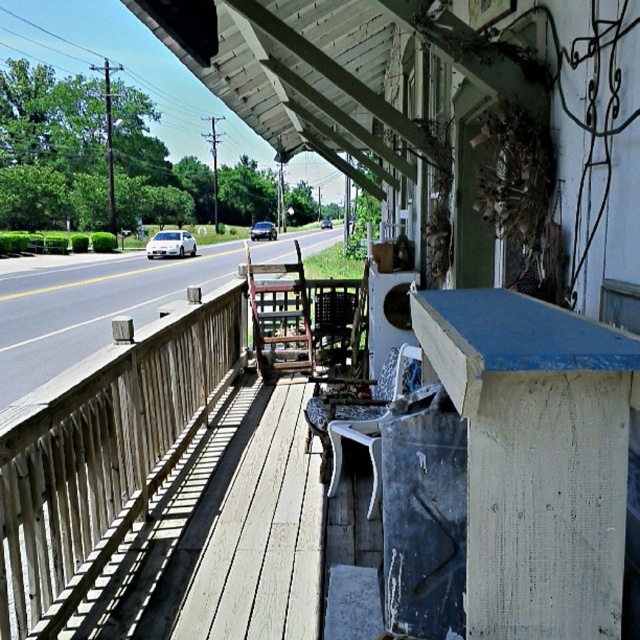
Can you confirm if white plastic rocking chair at center is wider than wooden chair at center?

Yes.

What are the coordinates of `white plastic rocking chair at center` in the screenshot? It's located at [x=369, y=416].